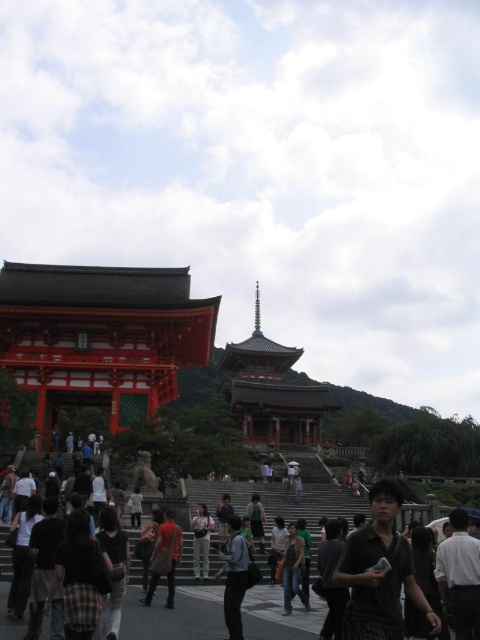
You are a photographer standing at the temple steps. You notice two visitors wearing a plaid fabric shirt at lower left and a white cotton shirt at lower right. Which visitor is shorter in height?

The plaid fabric shirt at lower left is not as tall as the white cotton shirt at lower right, so the visitor wearing the plaid fabric shirt at lower left is shorter in height.

You are a photographer standing in the temple complex and you want to capture both the plaid fabric shirt at lower left and the white cotton shirt at lower right in the same frame. Which shirt should you focus on first to ensure both are visible in your photo?

The plaid fabric shirt at lower left is positioned over the white cotton shirt at lower right, so focusing on the plaid fabric shirt at lower left first will ensure both are visible in the frame.